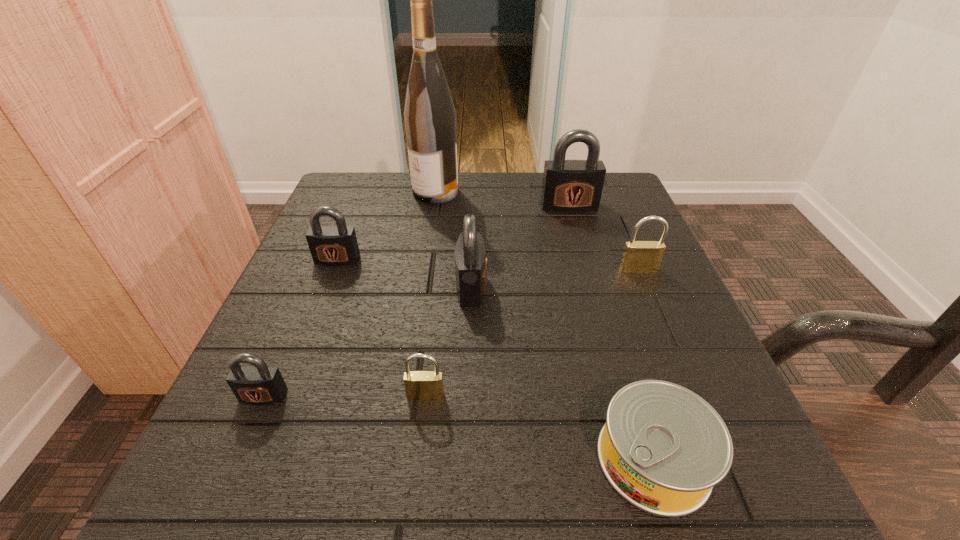
In the image, there is a desktop. At what (x,y) coordinates should I click in order to perform the action: click on vacant region at the right edge. Please return your answer as a coordinate pair (x, y). Image resolution: width=960 pixels, height=540 pixels. Looking at the image, I should click on (653, 290).

In the image, there is a desktop. In order to click on vacant region at the far left corner in this screenshot , I will do coord(359,201).

In the image, there is a desktop. Where is `vacant space at the far right corner`? This screenshot has width=960, height=540. vacant space at the far right corner is located at coordinates (602, 221).

The image size is (960, 540). In order to click on vacant region between the tallest object and the nearest gray padlock in this screenshot , I will do `click(349, 294)`.

Identify the location of vacant space that is in between the second smallest gray padlock and the right brass padlock. The width and height of the screenshot is (960, 540). tap(488, 264).

Identify the location of free space between the nearest gray padlock and the rightmost padlock. (451, 333).

Locate an element on the screen. empty space that is in between the third biggest gray padlock and the nearest object is located at coordinates (495, 359).

Image resolution: width=960 pixels, height=540 pixels. Identify the location of free space between the smallest gray padlock and the right brass padlock. (451, 333).

At what (x,y) coordinates should I click in order to perform the action: click on free spot between the right brass padlock and the third padlock from right to left. Please return your answer as a coordinate pair (x, y). Looking at the image, I should click on (555, 278).

Locate an element on the screen. Image resolution: width=960 pixels, height=540 pixels. free space between the tallest padlock and the second smallest gray padlock is located at coordinates (453, 233).